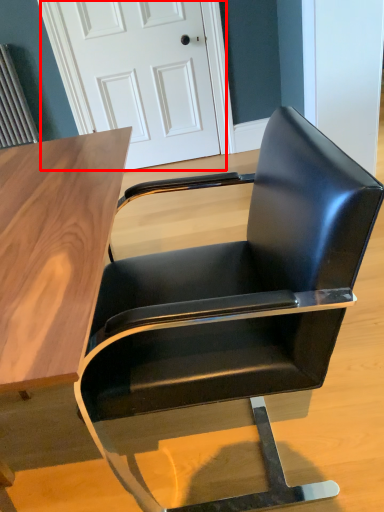
Question: From the image's perspective, considering the relative positions of door (annotated by the red box) and chair in the image provided, where is door (annotated by the red box) located with respect to the staircase?

Choices:
 (A) below
 (B) above

Answer: (B)